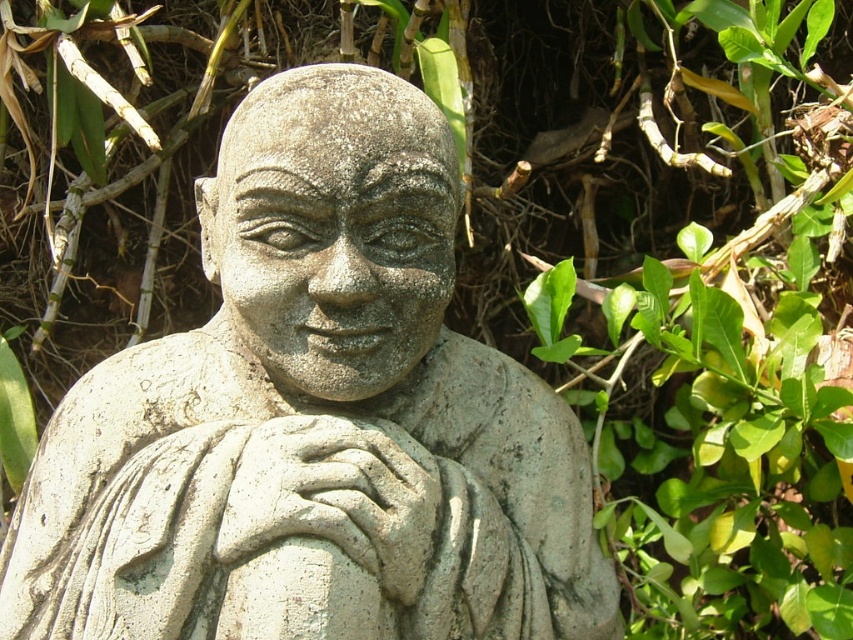
You are standing in front of the gray stone statue at center. If you want to touch the statue, will your hand reach it from where you are standing?

The gray stone statue at center and viewer are 36.77 inches apart, so yes, your hand can reach it since the distance is within arm length.

You are an art conservator examining the gray stone statue at center and the gray stone hand at center. Based on their sizes, which object might require a larger protective covering to prevent weathering?

The gray stone statue at center is larger in size than the gray stone hand at center, so it would require a larger protective covering to prevent weathering.